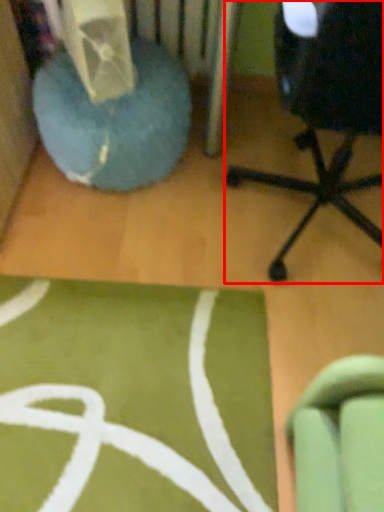
Question: Observing the image, what is the correct spatial positioning of chair (annotated by the red box) in reference to bean bag chair?

Choices:
 (A) left
 (B) right

Answer: (B)